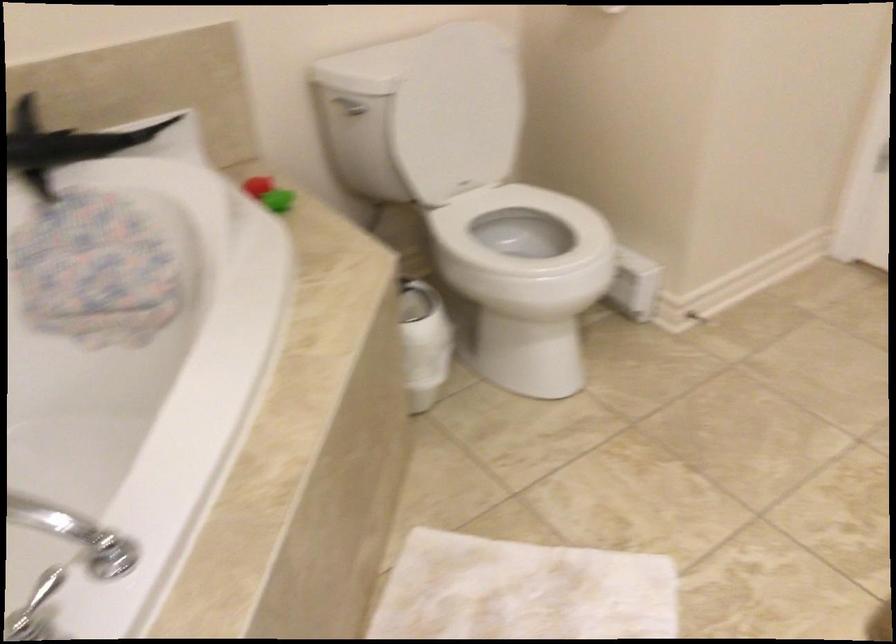
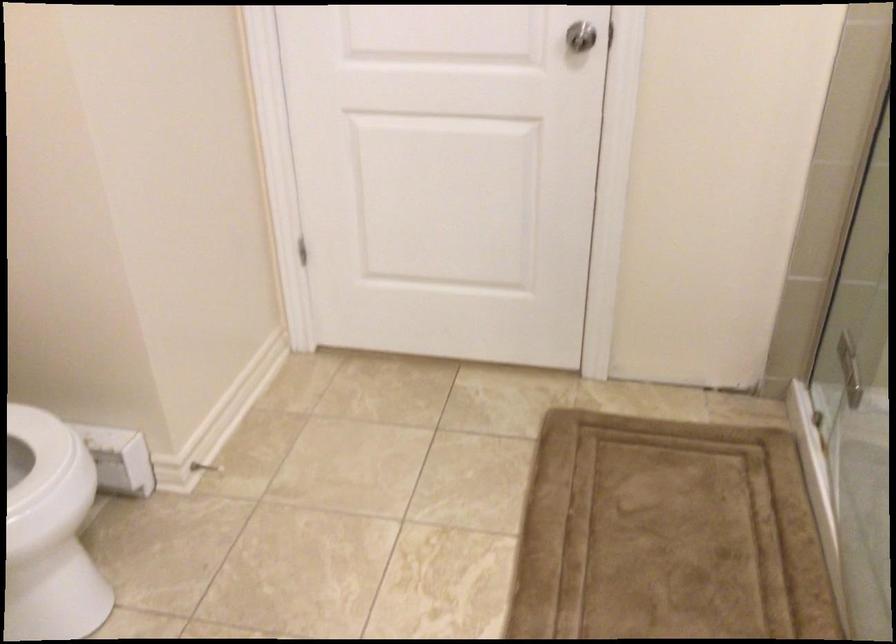
Question: The first image is from the beginning of the video and the second image is from the end. How did the camera likely rotate when shooting the video?

Choices:
 (A) Left
 (B) Right
 (C) Up
 (D) Down

Answer: (B)